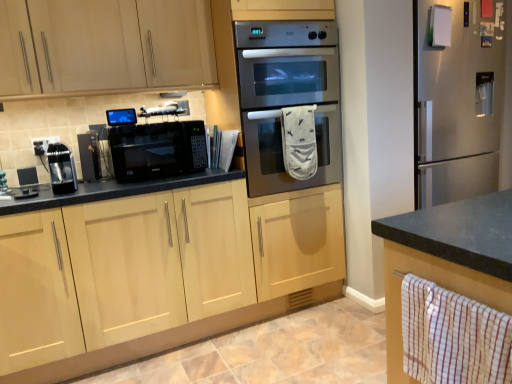
The width and height of the screenshot is (512, 384). What do you see at coordinates (157, 150) in the screenshot?
I see `black matte microwave at center` at bounding box center [157, 150].

Identify the location of black plastic electric outlet at upper left. The height and width of the screenshot is (384, 512). (42, 144).

Measure the distance between black matte coffee maker at left, positioned as the second appliance in left-to-right order, and camera.

The distance of black matte coffee maker at left, positioned as the second appliance in left-to-right order, from camera is 7.13 feet.

Identify the location of white cotton hand towel at center, marked as the 1th hand towel in a top-to-bottom arrangement. The width and height of the screenshot is (512, 384). (298, 141).

What do you see at coordinates (104, 46) in the screenshot? I see `light wood cabinet at upper left, placed as the 1th cabinetry when sorted from top to bottom` at bounding box center [104, 46].

The image size is (512, 384). In order to click on black matte microwave at center in this screenshot , I will do `click(157, 150)`.

Which object is more forward, white cotton hand towel at center, which is the first hand towel from left to right, or light wood/finish cabinet at center, which ranks as the first cabinetry in bottom-to-top order?

light wood/finish cabinet at center, which ranks as the first cabinetry in bottom-to-top order, is closer to the camera.

How far apart are white cotton hand towel at center, which ranks as the 2th hand towel in right-to-left order, and light wood/finish cabinet at center, which is the 2th cabinetry from top to bottom?

white cotton hand towel at center, which ranks as the 2th hand towel in right-to-left order, and light wood/finish cabinet at center, which is the 2th cabinetry from top to bottom, are 31.62 inches apart from each other.

Looking at their sizes, would you say white cotton hand towel at center, which is the first hand towel from left to right, is wider or thinner than light wood/finish cabinet at center, which is the 2th cabinetry from top to bottom?

white cotton hand towel at center, which is the first hand towel from left to right, is thinner than light wood/finish cabinet at center, which is the 2th cabinetry from top to bottom.

From a real-world perspective, is white cotton hand towel at center, the 2th hand towel when ordered from front to back, below light wood/finish cabinet at center, which is the 2th cabinetry from top to bottom?

Actually, white cotton hand towel at center, the 2th hand towel when ordered from front to back, is physically above light wood/finish cabinet at center, which is the 2th cabinetry from top to bottom, in the real world.

From the image's perspective, is light wood/finish cabinet at center, which ranks as the first cabinetry in bottom-to-top order, on light wood cabinet at upper left, which is counted as the 2th cabinetry, starting from the bottom?

Incorrect, from the image's perspective, light wood/finish cabinet at center, which ranks as the first cabinetry in bottom-to-top order, is lower than light wood cabinet at upper left, which is counted as the 2th cabinetry, starting from the bottom.

Between light wood/finish cabinet at center, which is the 2th cabinetry from top to bottom, and light wood cabinet at upper left, which is counted as the 2th cabinetry, starting from the bottom, which one is positioned in front?

light wood/finish cabinet at center, which is the 2th cabinetry from top to bottom, is more forward.

From a real-world perspective, is light wood/finish cabinet at center, which ranks as the first cabinetry in bottom-to-top order, located beneath light wood cabinet at upper left, placed as the 1th cabinetry when sorted from top to bottom?

Yes, from a real-world perspective, light wood/finish cabinet at center, which ranks as the first cabinetry in bottom-to-top order, is beneath light wood cabinet at upper left, placed as the 1th cabinetry when sorted from top to bottom.

Which is more to the right, light wood/finish cabinet at center, which ranks as the first cabinetry in bottom-to-top order, or light wood cabinet at upper left, which is counted as the 2th cabinetry, starting from the bottom?

From the viewer's perspective, light wood/finish cabinet at center, which ranks as the first cabinetry in bottom-to-top order, appears more on the right side.

In the scene shown: Considering the relative positions of black plastic electric outlet at upper left and white checkered hand towel at lower right, marked as the 2th hand towel in a left-to-right arrangement, in the image provided, is black plastic electric outlet at upper left to the right of white checkered hand towel at lower right, marked as the 2th hand towel in a left-to-right arrangement, from the viewer's perspective?

In fact, black plastic electric outlet at upper left is to the left of white checkered hand towel at lower right, marked as the 2th hand towel in a left-to-right arrangement.

Is white checkered hand towel at lower right, arranged as the 1th hand towel when viewed from the front, inside black plastic electric outlet at upper left?

No, black plastic electric outlet at upper left does not contain white checkered hand towel at lower right, arranged as the 1th hand towel when viewed from the front.

From a real-world perspective, is black plastic electric outlet at upper left located beneath white checkered hand towel at lower right, marked as the 2th hand towel in a left-to-right arrangement?

Incorrect, from a real-world perspective, black plastic electric outlet at upper left is higher than white checkered hand towel at lower right, marked as the 2th hand towel in a left-to-right arrangement.

How different are the orientations of black plastic electric outlet at upper left and white checkered hand towel at lower right, the first hand towel when ordered from right to left, in degrees?

0.428 degrees.

From the image's perspective, is black plastic electric outlet at upper left below light wood cabinet at upper left, which is counted as the 2th cabinetry, starting from the bottom?

Yes, from the image's perspective, black plastic electric outlet at upper left is beneath light wood cabinet at upper left, which is counted as the 2th cabinetry, starting from the bottom.

From a real-world perspective, which object rests below the other?

From a 3D spatial view, black plastic electric outlet at upper left is below.

Considering the relative sizes of black plastic electric outlet at upper left and light wood cabinet at upper left, placed as the 1th cabinetry when sorted from top to bottom, in the image provided, is black plastic electric outlet at upper left bigger than light wood cabinet at upper left, placed as the 1th cabinetry when sorted from top to bottom,?

Actually, black plastic electric outlet at upper left might be smaller than light wood cabinet at upper left, placed as the 1th cabinetry when sorted from top to bottom.

In the scene shown: From a real-world perspective, which is physically above, matte black microwave at center, arranged as the 3th appliance when viewed from the left, or black matte coffee maker at left, the second appliance positioned from the right?

matte black microwave at center, arranged as the 3th appliance when viewed from the left, is physically above.

Is matte black microwave at center, arranged as the 3th appliance when viewed from the left, located outside black matte coffee maker at left, positioned as the second appliance in left-to-right order?

Yes, matte black microwave at center, arranged as the 3th appliance when viewed from the left, is located beyond the bounds of black matte coffee maker at left, positioned as the second appliance in left-to-right order.

Consider the image. Can you confirm if matte black microwave at center, arranged as the 1th appliance when viewed from the right, is shorter than black matte coffee maker at left, positioned as the second appliance in left-to-right order?

Indeed, matte black microwave at center, arranged as the 1th appliance when viewed from the right, has a lesser height compared to black matte coffee maker at left, positioned as the second appliance in left-to-right order.

From the image's perspective, which is above, white checkered hand towel at lower right, which is the second hand towel in back-to-front order, or black matte microwave at center?

black matte microwave at center appears higher in the image.

From a real-world perspective, is white checkered hand towel at lower right, the first hand towel when ordered from right to left, physically located above or below black matte microwave at center?

From a real-world perspective, white checkered hand towel at lower right, the first hand towel when ordered from right to left, is physically below black matte microwave at center.

Is white checkered hand towel at lower right, which is the 1th hand towel from bottom to top, oriented away from black matte microwave at center?

Yes.

From the image's perspective, is matte black microwave at center, arranged as the 1th appliance when viewed from the right, above black plastic electric outlet at upper left?

Yes.

Which is in front, point (130, 118) or point (44, 149)?

The point (44, 149) is closer.

Is matte black microwave at center, arranged as the 1th appliance when viewed from the right, in front of or behind black plastic electric outlet at upper left in the image?

matte black microwave at center, arranged as the 1th appliance when viewed from the right, is in front of black plastic electric outlet at upper left.

From the image's perspective, which hand towel is the 2nd one above the light wood/finish cabinet at center, which ranks as the first cabinetry in bottom-to-top order? Please provide its 2D coordinates.

[(298, 141)]

The width and height of the screenshot is (512, 384). What are the coordinates of `cabinetry in front of the light wood cabinet at upper left, which is counted as the 2th cabinetry, starting from the bottom` in the screenshot? It's located at pyautogui.click(x=121, y=270).

Based on the photo, estimate the real-world distances between objects in this image. Which object is further from satin black coffee maker at left, acting as the first appliance starting from the left, black plastic electric outlet at upper left or light wood/finish cabinet at center, which ranks as the first cabinetry in bottom-to-top order?

Among the two, light wood/finish cabinet at center, which ranks as the first cabinetry in bottom-to-top order, is located further to satin black coffee maker at left, acting as the first appliance starting from the left.

From the image, which object appears to be farther from matte black microwave at center, arranged as the 1th appliance when viewed from the right, light wood/finish cabinet at center, which is the 2th cabinetry from top to bottom, or satin black microwave at center?

satin black microwave at center is further to matte black microwave at center, arranged as the 1th appliance when viewed from the right.

Estimate the real-world distances between objects in this image. Which object is further from black plastic electric outlet at upper left, black matte coffee maker at left, the second appliance positioned from the right, or satin black microwave at center?

The object further to black plastic electric outlet at upper left is satin black microwave at center.

Based on the photo, from the image, which object appears to be nearer to black matte coffee maker at left, positioned as the second appliance in left-to-right order, black matte microwave at center or satin black microwave at center?

The object closer to black matte coffee maker at left, positioned as the second appliance in left-to-right order, is black matte microwave at center.

Estimate the real-world distances between objects in this image. Which object is closer to satin black microwave at center, black matte microwave at center or white cotton hand towel at center, which appears as the 1th hand towel when viewed from the back?

The object closer to satin black microwave at center is white cotton hand towel at center, which appears as the 1th hand towel when viewed from the back.

When comparing their distances from white checkered hand towel at lower right, which is the 1th hand towel from bottom to top, does black matte microwave at center or light wood/finish cabinet at center, which is the 2th cabinetry from top to bottom, seem further?

black matte microwave at center lies further to white checkered hand towel at lower right, which is the 1th hand towel from bottom to top, than the other object.

From the image, which object appears to be nearer to matte black microwave at center, arranged as the 1th appliance when viewed from the right, satin black microwave at center or black plastic electric outlet at upper left?

black plastic electric outlet at upper left.

Estimate the real-world distances between objects in this image. Which object is further from light wood/finish cabinet at center, which ranks as the first cabinetry in bottom-to-top order, white checkered hand towel at lower right, marked as the 2th hand towel in a left-to-right arrangement, or white cotton hand towel at center, which appears as the 1th hand towel when viewed from the back?

white checkered hand towel at lower right, marked as the 2th hand towel in a left-to-right arrangement, lies further to light wood/finish cabinet at center, which ranks as the first cabinetry in bottom-to-top order, than the other object.

Locate an element on the screen. home appliance situated between light wood cabinet at upper left, which is counted as the 2th cabinetry, starting from the bottom, and white cotton hand towel at center, which is the 2th hand towel from bottom to top, from left to right is located at coordinates (157, 150).

Locate an element on the screen. The width and height of the screenshot is (512, 384). microwave oven between satin black coffee maker at left, acting as the first appliance starting from the left, and white checkered hand towel at lower right, arranged as the 1th hand towel when viewed from the front, from left to right is located at coordinates (287, 98).

This screenshot has width=512, height=384. In order to click on home appliance between light wood/finish cabinet at center, which is the 2th cabinetry from top to bottom, and white cotton hand towel at center, which ranks as the 2th hand towel in right-to-left order, from left to right in this screenshot , I will do `click(157, 150)`.

Identify the location of appliance located between light wood/finish cabinet at center, which ranks as the first cabinetry in bottom-to-top order, and white cotton hand towel at center, which ranks as the 2th hand towel in right-to-left order, in the left-right direction. (121, 117).